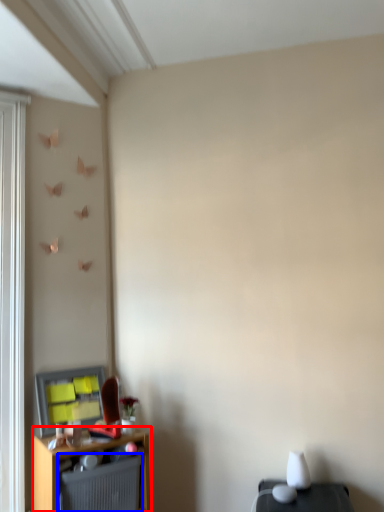
Question: Which of the following is the farthest to the observer, shelf (highlighted by a red box) or radiator (highlighted by a blue box)?

Choices:
 (A) shelf
 (B) radiator

Answer: (B)